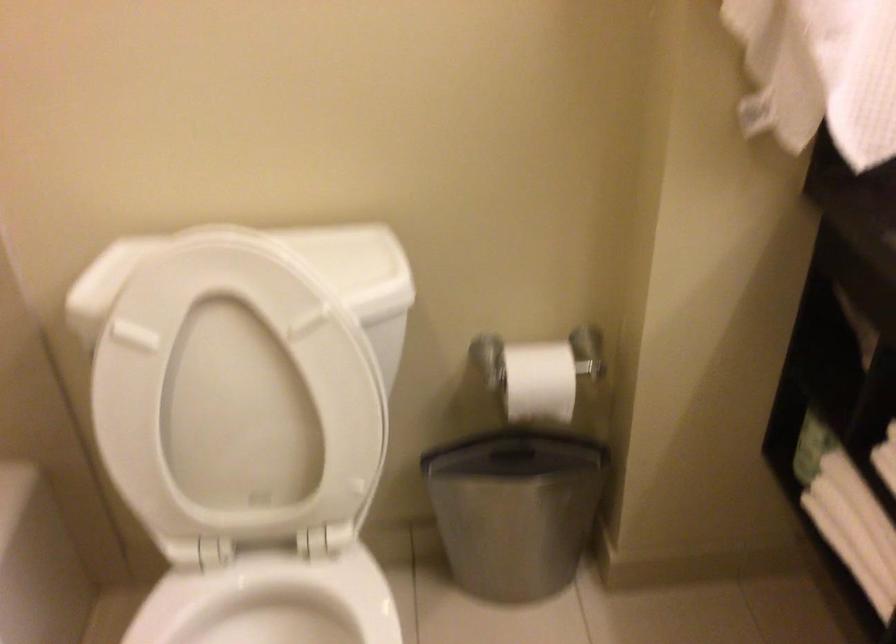
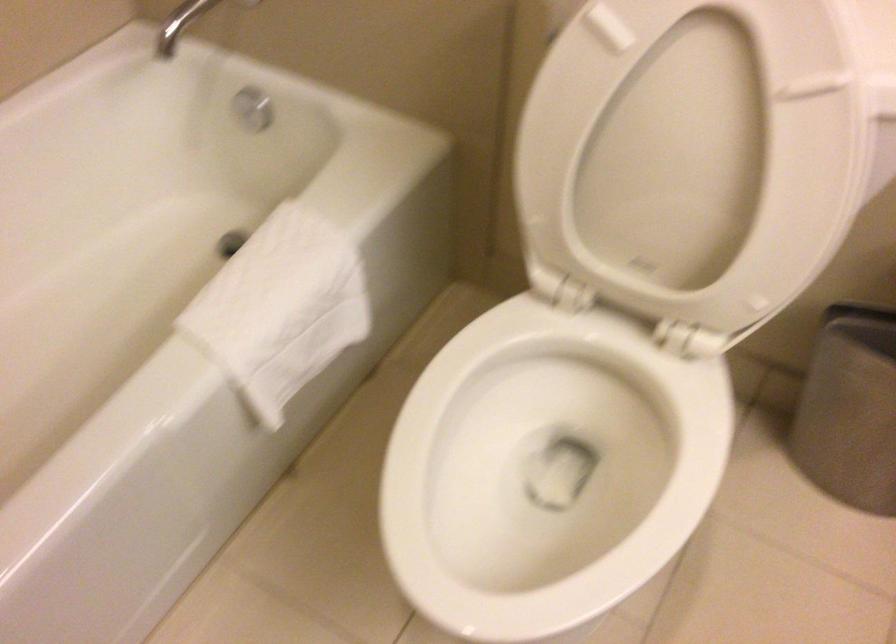
The point at (254, 401) is marked in the first image. Where is the corresponding point in the second image?

(691, 154)